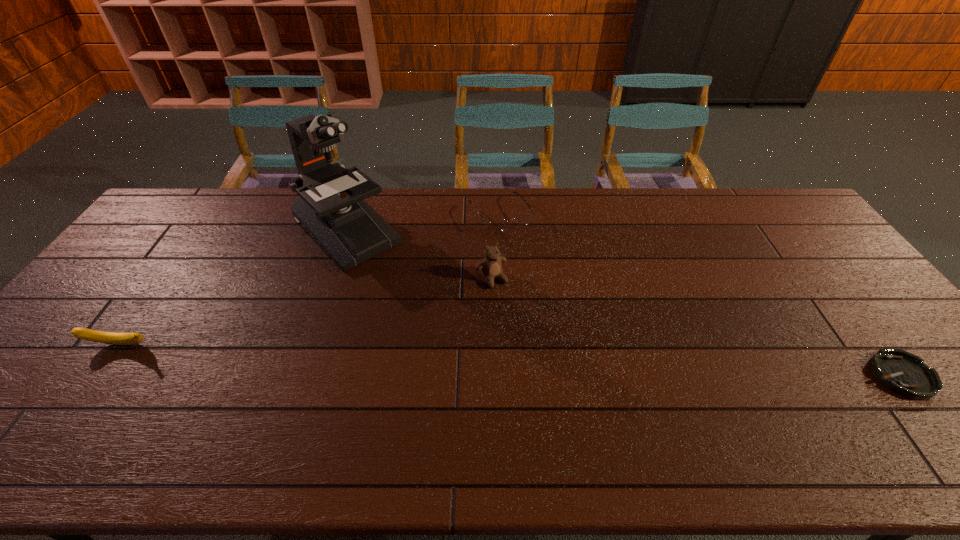
You are a GUI agent. You are given a task and a screenshot of the screen. Output one action in this format:
    pyautogui.click(x=<x>, y=<y>)
    Task: Click on the banana
    
    Given the screenshot: What is the action you would take?
    pyautogui.click(x=112, y=338)

At what (x,y) coordinates should I click in order to perform the action: click on the leftmost object. Please return your answer as a coordinate pair (x, y). The height and width of the screenshot is (540, 960). Looking at the image, I should click on (112, 338).

The width and height of the screenshot is (960, 540). What are the coordinates of `the rightmost object` in the screenshot? It's located at (904, 373).

The image size is (960, 540). What are the coordinates of `the nearest object` in the screenshot? It's located at (904, 373).

In order to click on microscope in this screenshot , I will do [x=330, y=206].

I want to click on the fourth object from right to left, so click(x=330, y=206).

Where is `teddy bear`? teddy bear is located at coordinates (491, 267).

This screenshot has width=960, height=540. I want to click on spectacles, so click(496, 226).

Where is `free space located at the stem of the leftmost object`? The width and height of the screenshot is (960, 540). free space located at the stem of the leftmost object is located at coordinates (96, 378).

Where is `free space located 0.100m on the back of the rightmost object`? Image resolution: width=960 pixels, height=540 pixels. free space located 0.100m on the back of the rightmost object is located at coordinates (859, 322).